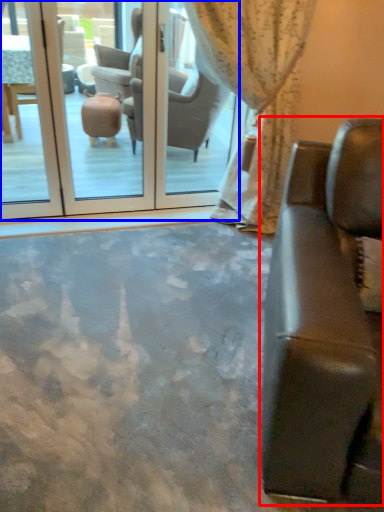
Question: Which object appears farthest to the camera in this image, studio couch (highlighted by a red box) or screen door (highlighted by a blue box)?

Choices:
 (A) studio couch
 (B) screen door

Answer: (B)